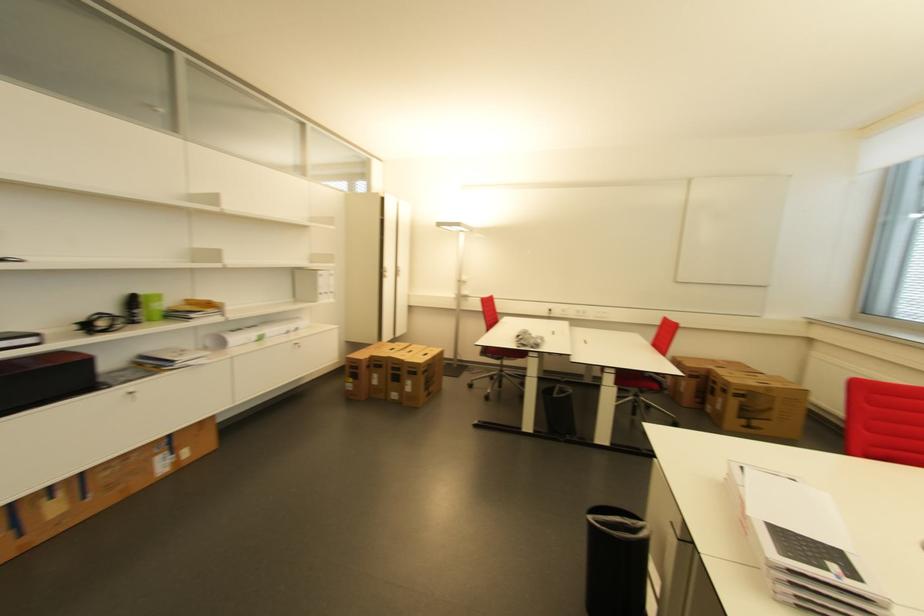
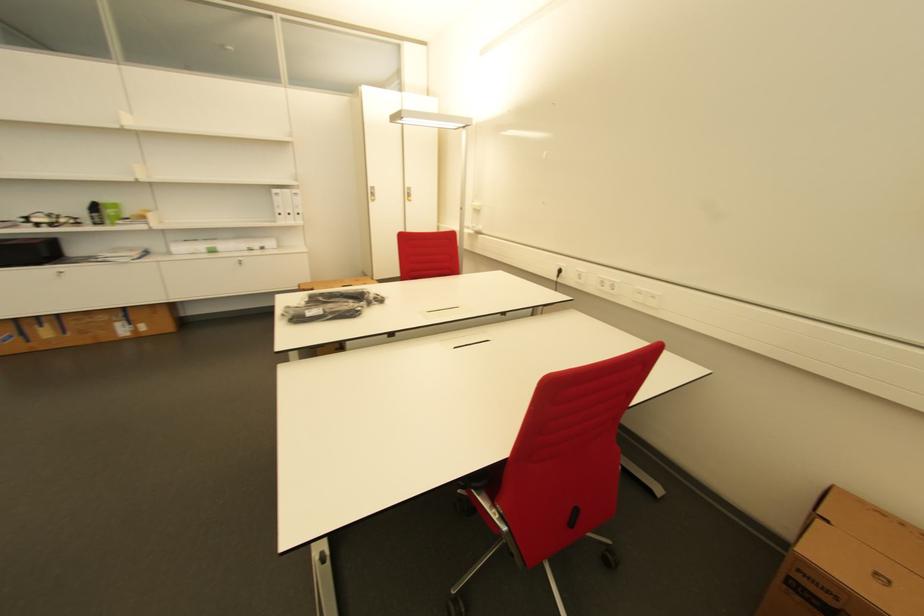
Where in the second image is the point corresponding to (x=138, y=302) from the first image?

(100, 209)